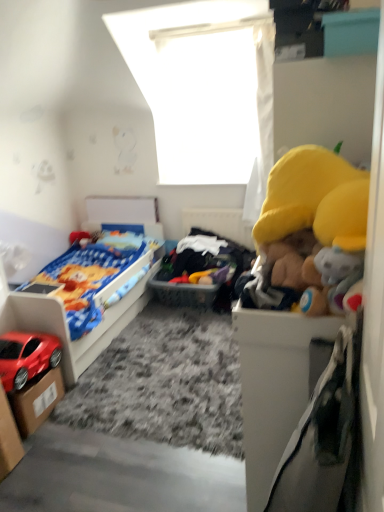
Find the location of a particular element. This screenshot has height=512, width=384. unoccupied region to the right of cardboard box at lower left, the first storage box when ordered from front to back is located at coordinates (32, 460).